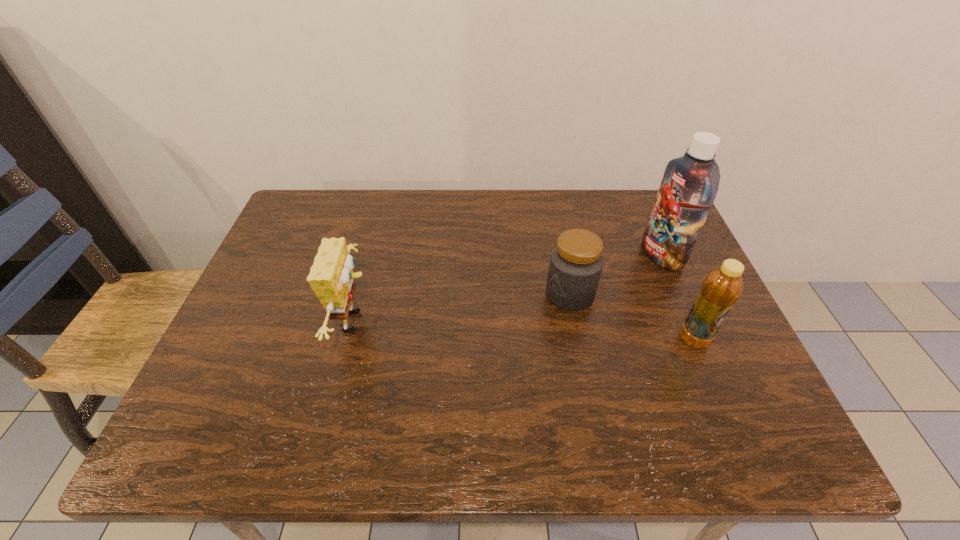
This screenshot has width=960, height=540. I want to click on free space between the bottle and the farthest object, so click(x=678, y=298).

Locate an element on the screen. object that is the nearest to the bottle is located at coordinates (576, 263).

At what (x,y) coordinates should I click in order to perform the action: click on object that is the closest one to the second object from left to right. Please return your answer as a coordinate pair (x, y). This screenshot has width=960, height=540. Looking at the image, I should click on (690, 183).

Where is `vacant region that satisfies the following two spatial constraints: 1. on the back side of the shampoo; 2. on the right side of the jar`? vacant region that satisfies the following two spatial constraints: 1. on the back side of the shampoo; 2. on the right side of the jar is located at coordinates (563, 256).

This screenshot has width=960, height=540. In order to click on free space that satisfies the following two spatial constraints: 1. on the back side of the bottle; 2. on the left side of the farthest object in this screenshot , I will do `click(659, 256)`.